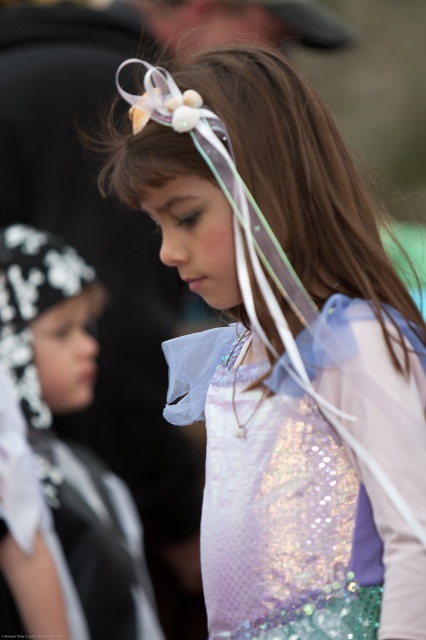
Question: Which of the following is the closest to the observer?

Choices:
 (A) (262, 572)
 (B) (46, 250)

Answer: (A)

Question: Which of the following is the closest to the observer?

Choices:
 (A) white sequined cape at left
 (B) holographic sequin dress at center

Answer: (B)

Question: Does holographic sequin dress at center have a smaller size compared to white sequined cape at left?

Choices:
 (A) no
 (B) yes

Answer: (B)

Question: Is holographic sequin dress at center wider than white sequined cape at left?

Choices:
 (A) yes
 (B) no

Answer: (A)

Question: Is holographic sequin dress at center further to the viewer compared to white sequined cape at left?

Choices:
 (A) yes
 (B) no

Answer: (B)

Question: Which point is farther from the camera taking this photo?

Choices:
 (A) (271, 376)
 (B) (121, 602)

Answer: (B)